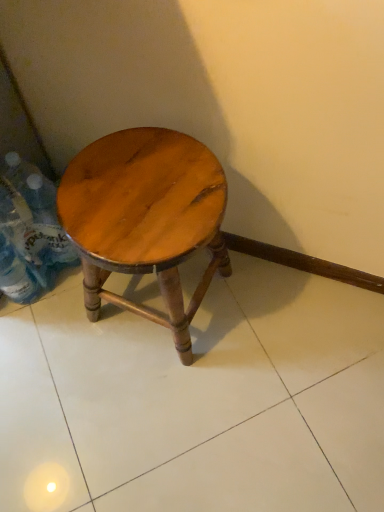
This screenshot has height=512, width=384. What are the coordinates of `vacant area located to the right-hand side of wooden stool at center` in the screenshot? It's located at (258, 316).